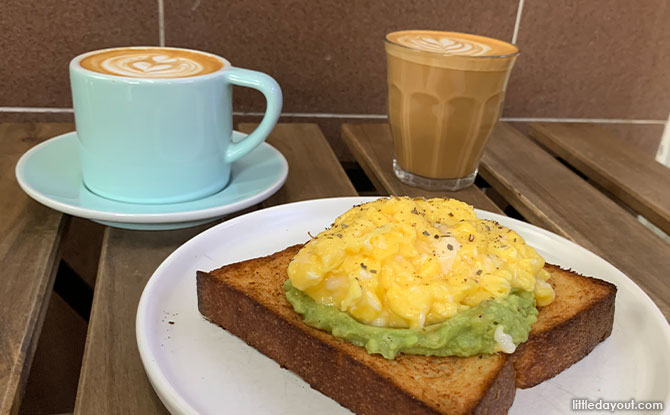
Identify the location of small blue plate. (143, 211).